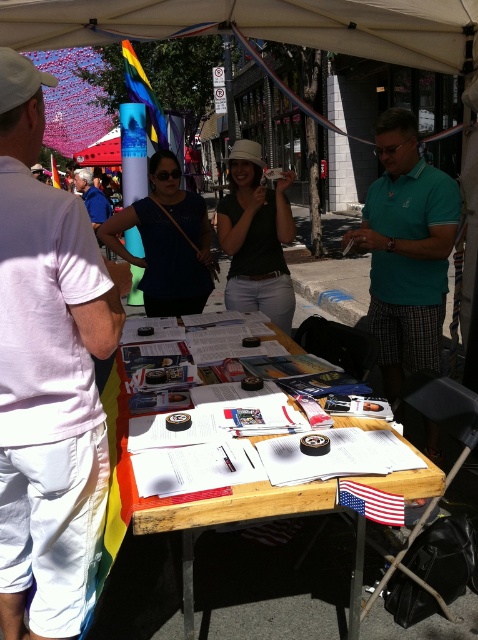
Is matte black shirt at center in front of rainbow fabric flag at upper left?

Yes, matte black shirt at center is in front of rainbow fabric flag at upper left.

Between matte black shirt at center and rainbow fabric flag at upper left, which one is positioned lower?

Positioned lower is matte black shirt at center.

Does point (234, 198) come closer to viewer compared to point (150, 124)?

Yes, it is.

You are a GUI agent. You are given a task and a screenshot of the screen. Output one action in this format:
    pyautogui.click(x=<x>, y=<y>)
    Task: Click on the matte black shirt at center
    This screenshot has height=640, width=478.
    Given the screenshot: What is the action you would take?
    click(256, 237)

Is american flag at center bigger than rainbow fabric flag at upper left?

Incorrect, american flag at center is not larger than rainbow fabric flag at upper left.

Where is `american flag at center`? The width and height of the screenshot is (478, 640). american flag at center is located at coordinates 371,502.

Does point (379, 497) lie in front of point (162, 120)?

Yes.

Locate an element on the screen. Image resolution: width=478 pixels, height=640 pixels. american flag at center is located at coordinates (371, 502).

Which is in front, point (260, 205) or point (386, 520)?

Point (386, 520) is in front.

The image size is (478, 640). What do you see at coordinates (256, 237) in the screenshot?
I see `matte black shirt at center` at bounding box center [256, 237].

Does point (282, 227) lie in front of point (369, 490)?

No, it is not.

I want to click on matte black shirt at center, so click(x=256, y=237).